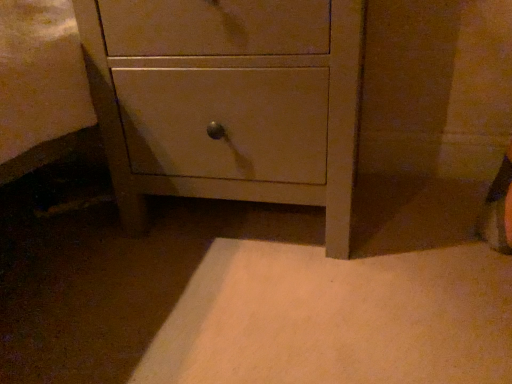
Identify the location of matte gray drawer at center. This screenshot has width=512, height=384. (228, 101).

Describe the element at coordinates (228, 101) in the screenshot. The height and width of the screenshot is (384, 512). I see `matte gray drawer at center` at that location.

The image size is (512, 384). What are the coordinates of `matte gray drawer at center` in the screenshot? It's located at (228, 101).